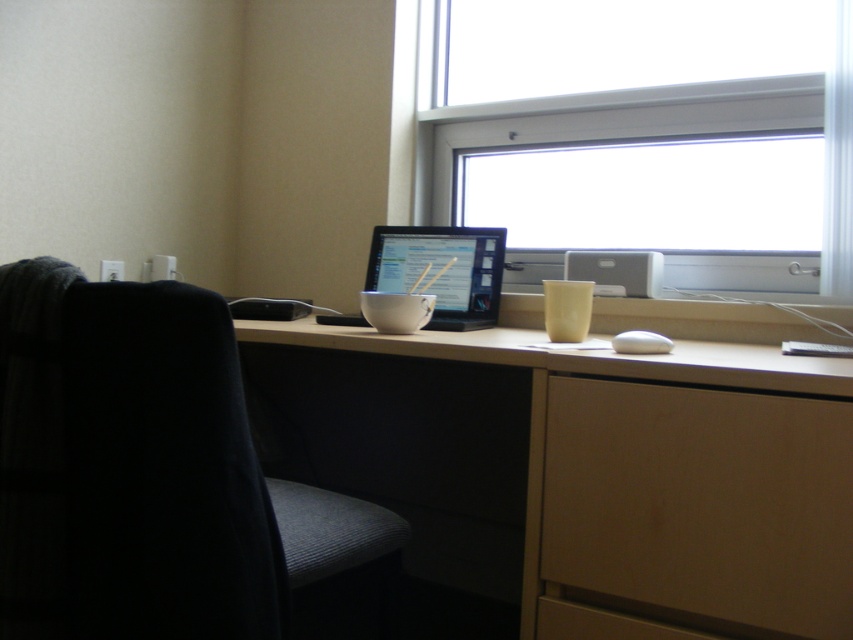
You are standing in front of the desk and want to reach both points on the desk. Which point, point (561, 602) or point (425, 228), is closer to you?

Point (561, 602) is closer to the viewer than point (425, 228).

You are organizing the desk and need to place a new item between the transparent glass window at upper center and the wooden drawer at lower right. Which object should you place the item closer to if you want it to be near the taller object?

The transparent glass window at upper center is taller than the wooden drawer at lower right, so you should place the item closer to the transparent glass window at upper center.